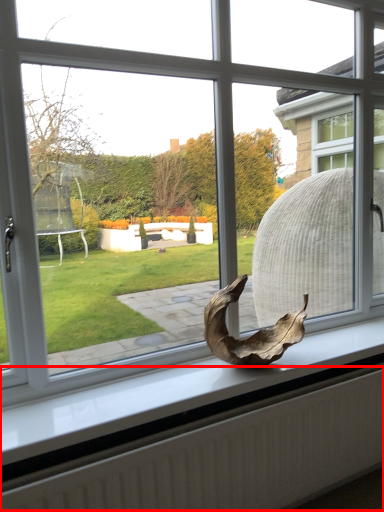
Question: Considering the relative positions of radiator (annotated by the red box) and animal in the image provided, where is radiator (annotated by the red box) located with respect to the staircase?

Choices:
 (A) left
 (B) right

Answer: (A)